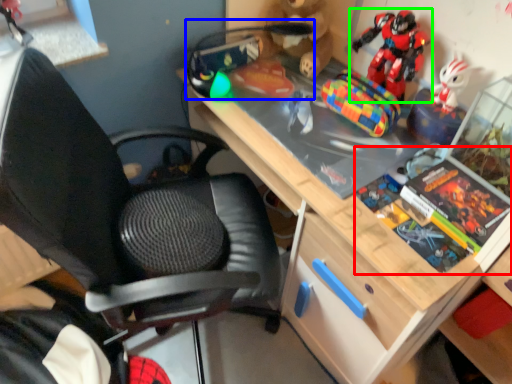
Question: Based on their relative distances, which object is nearer to book (highlighted by a red box)? Choose from toy (highlighted by a blue box) and toy (highlighted by a green box).

Choices:
 (A) toy
 (B) toy

Answer: (B)